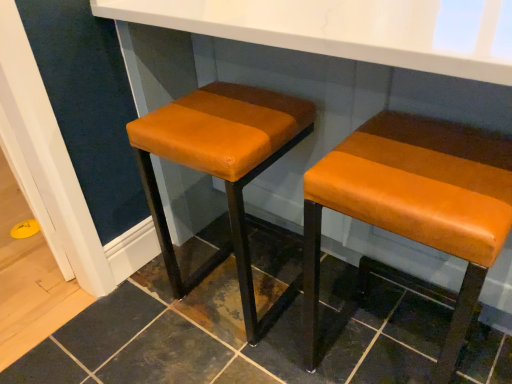
The height and width of the screenshot is (384, 512). I want to click on vacant region above orange leather stool at right, the 1th stool in the right-to-left sequence (from a real-world perspective), so click(x=429, y=160).